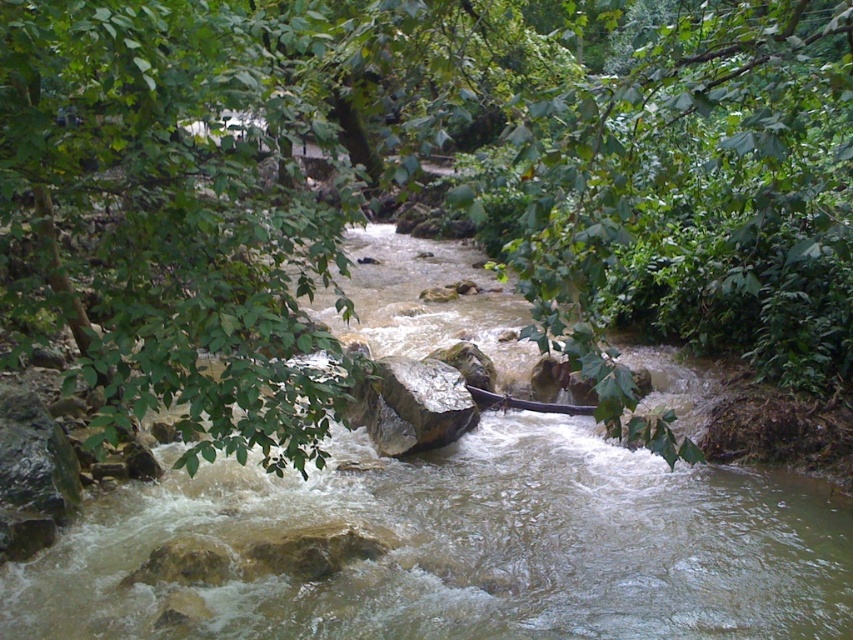
Question: Which point is closer to the camera taking this photo?

Choices:
 (A) (509, 401)
 (B) (426, 628)

Answer: (B)

Question: Is brown rocky stream at center bigger than brown wooden canoe at center?

Choices:
 (A) no
 (B) yes

Answer: (B)

Question: Does brown rocky stream at center have a lesser width compared to brown wooden canoe at center?

Choices:
 (A) yes
 (B) no

Answer: (B)

Question: Is brown rocky stream at center further to camera compared to brown wooden canoe at center?

Choices:
 (A) yes
 (B) no

Answer: (B)

Question: Which of the following is the farthest from the observer?

Choices:
 (A) brown rocky stream at center
 (B) brown wooden canoe at center

Answer: (B)